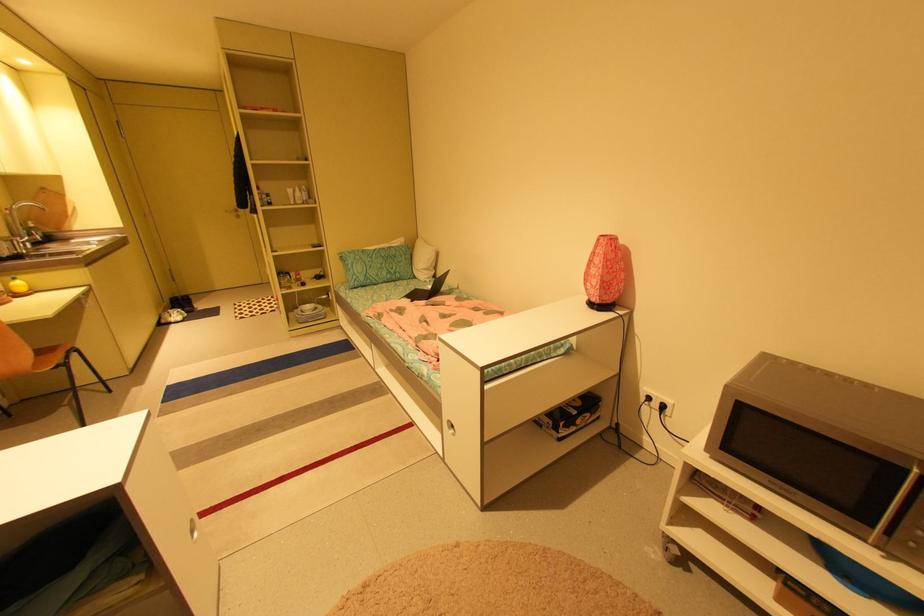
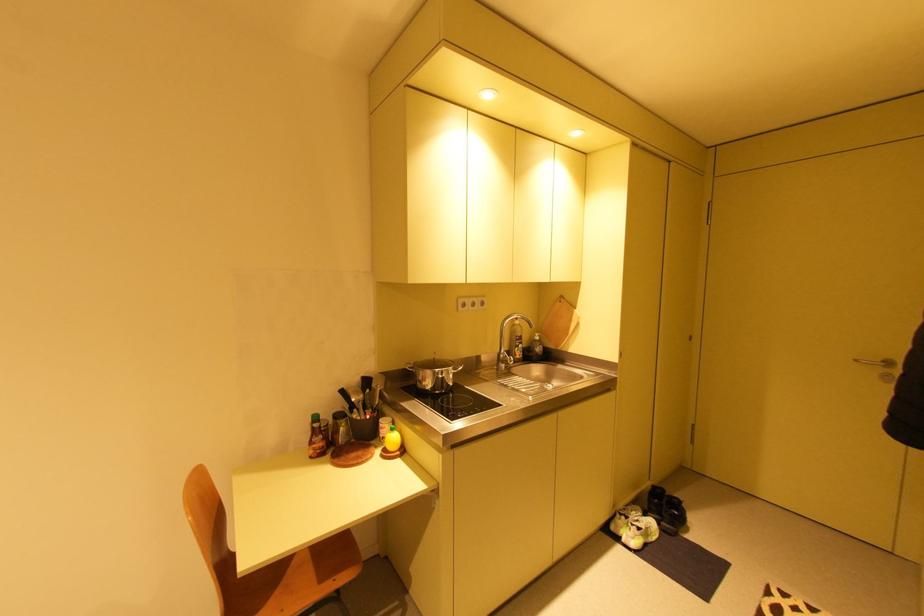
Locate, in the second image, the point that corresponds to [176,323] in the first image.

(623, 538)